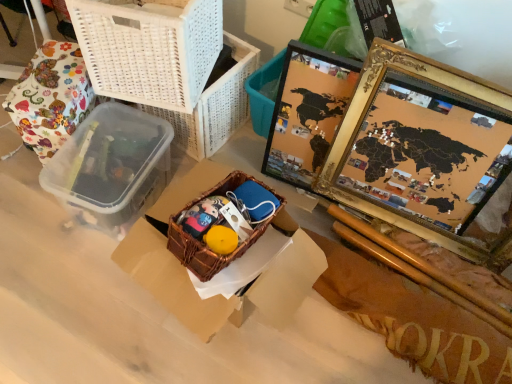
Question: Is gold-framed map at right positioned with its back to woven brown basket at center?

Choices:
 (A) yes
 (B) no

Answer: (B)

Question: Considering the relative sizes of gold-framed map at right and woven brown basket at center in the image provided, is gold-framed map at right bigger than woven brown basket at center?

Choices:
 (A) yes
 (B) no

Answer: (A)

Question: Can woven brown basket at center be found inside gold-framed map at right?

Choices:
 (A) yes
 (B) no

Answer: (B)

Question: Does gold-framed map at right appear on the left side of woven brown basket at center?

Choices:
 (A) no
 (B) yes

Answer: (A)

Question: Is gold-framed map at right at the right side of woven brown basket at center?

Choices:
 (A) yes
 (B) no

Answer: (A)

Question: Can you confirm if gold-framed map at right is smaller than woven brown basket at center?

Choices:
 (A) yes
 (B) no

Answer: (B)

Question: Is woven brown basket at center positioned behind brown woven basket at center?

Choices:
 (A) no
 (B) yes

Answer: (B)

Question: Does woven brown basket at center have a lesser width compared to brown woven basket at center?

Choices:
 (A) yes
 (B) no

Answer: (A)

Question: Is woven brown basket at center surrounding brown woven basket at center?

Choices:
 (A) yes
 (B) no

Answer: (B)

Question: Considering the relative sizes of woven brown basket at center and brown woven basket at center in the image provided, is woven brown basket at center wider than brown woven basket at center?

Choices:
 (A) yes
 (B) no

Answer: (B)

Question: Could you tell me if woven brown basket at center is facing brown woven basket at center?

Choices:
 (A) yes
 (B) no

Answer: (A)

Question: Is woven brown basket at center placed right next to brown woven basket at center?

Choices:
 (A) no
 (B) yes

Answer: (B)

Question: From the image's perspective, is floral fabric wrapped object at left below woven brown basket at center?

Choices:
 (A) no
 (B) yes

Answer: (A)